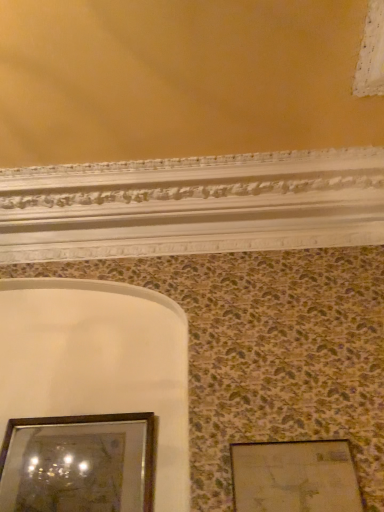
Question: In terms of height, does wooden picture frame at lower right, arranged as the second picture frame when viewed from the left, look taller or shorter compared to wooden framed mirror at lower left, arranged as the first picture frame when viewed from the left?

Choices:
 (A) tall
 (B) short

Answer: (B)

Question: Choose the correct answer: Is wooden picture frame at lower right, the 1th picture frame positioned from the right, inside wooden framed mirror at lower left, arranged as the first picture frame when viewed from the left, or outside it?

Choices:
 (A) outside
 (B) inside

Answer: (A)

Question: Is wooden picture frame at lower right, arranged as the second picture frame when viewed from the left, to the left or to the right of wooden framed mirror at lower left, marked as the 2th picture frame in a right-to-left arrangement, in the image?

Choices:
 (A) left
 (B) right

Answer: (B)

Question: From the image's perspective, is wooden framed mirror at lower left, marked as the 2th picture frame in a right-to-left arrangement, positioned above or below wooden picture frame at lower right, arranged as the second picture frame when viewed from the left?

Choices:
 (A) above
 (B) below

Answer: (B)

Question: Is wooden framed mirror at lower left, marked as the 2th picture frame in a right-to-left arrangement, taller or shorter than wooden picture frame at lower right, arranged as the second picture frame when viewed from the left?

Choices:
 (A) tall
 (B) short

Answer: (A)

Question: From a real-world perspective, is wooden framed mirror at lower left, arranged as the first picture frame when viewed from the left, physically located above or below wooden picture frame at lower right, the 1th picture frame positioned from the right?

Choices:
 (A) below
 (B) above

Answer: (B)

Question: Is wooden framed mirror at lower left, arranged as the first picture frame when viewed from the left, wider or thinner than wooden picture frame at lower right, arranged as the second picture frame when viewed from the left?

Choices:
 (A) wide
 (B) thin

Answer: (A)